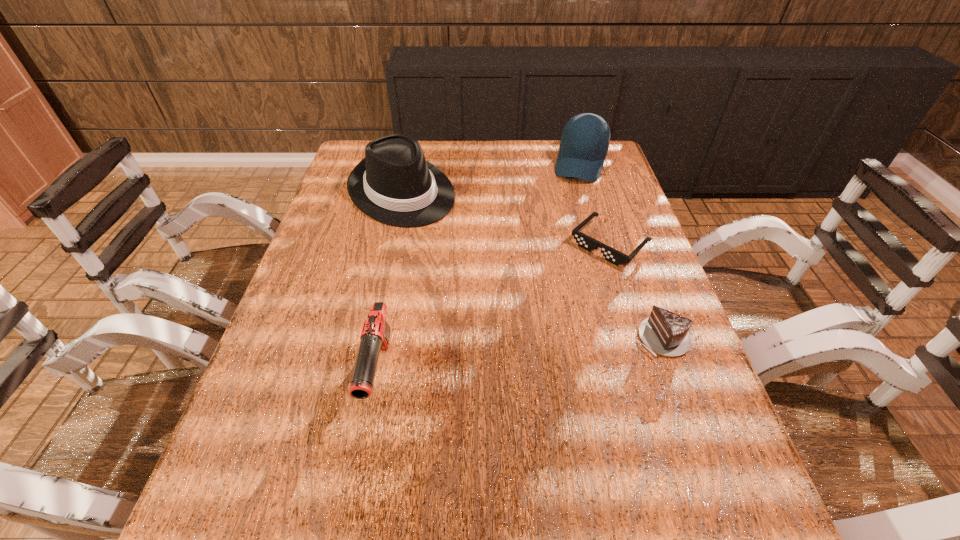
Locate an element on the screen. The height and width of the screenshot is (540, 960). free space between the shortest object and the gun is located at coordinates (494, 309).

The image size is (960, 540). What are the coordinates of `vacant region between the sunglasses and the baseball cap` in the screenshot? It's located at (595, 204).

This screenshot has height=540, width=960. I want to click on free space between the gun and the chocolate cake, so click(520, 356).

At what (x,y) coordinates should I click in order to perform the action: click on free space between the fedora and the baseball cap. Please return your answer as a coordinate pair (x, y). Looking at the image, I should click on (492, 177).

In order to click on vacant area that lies between the fourth tallest object and the shortest object in this screenshot , I will do `click(635, 291)`.

You are a GUI agent. You are given a task and a screenshot of the screen. Output one action in this format:
    pyautogui.click(x=<x>, y=<y>)
    Task: Click on the unoccupied position between the baseball cap and the shortest object
    
    Given the screenshot: What is the action you would take?
    pyautogui.click(x=595, y=204)

Where is `vacant space that is in between the second shortest object and the fedora`? The width and height of the screenshot is (960, 540). vacant space that is in between the second shortest object and the fedora is located at coordinates (531, 265).

Where is `vacant area that lies between the gun and the sunglasses`? This screenshot has height=540, width=960. vacant area that lies between the gun and the sunglasses is located at coordinates (494, 309).

This screenshot has height=540, width=960. Find the location of `vacant space in between the sunglasses and the gun`. vacant space in between the sunglasses and the gun is located at coordinates point(494,309).

Identify which object is located as the fourth nearest to the gun. Please provide its 2D coordinates. Your answer should be formatted as a tuple, i.e. [(x, y)], where the tuple contains the x and y coordinates of a point satisfying the conditions above.

[(585, 139)]